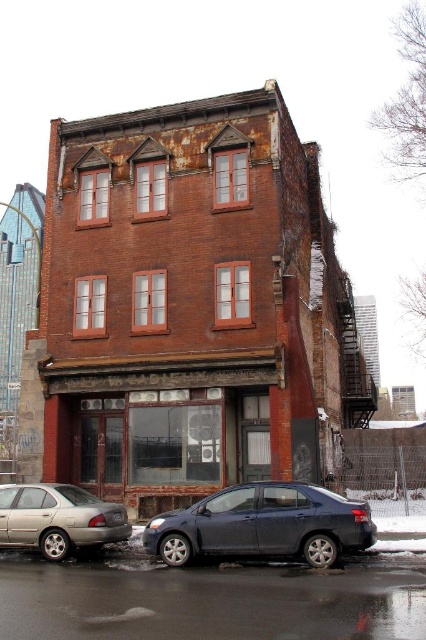
The height and width of the screenshot is (640, 426). What do you see at coordinates (262, 525) in the screenshot?
I see `satin dark blue sedan at lower center` at bounding box center [262, 525].

Is satin dark blue sedan at lower center thinner than silver metallic sedan at lower left?

In fact, satin dark blue sedan at lower center might be wider than silver metallic sedan at lower left.

This screenshot has width=426, height=640. Find the location of `satin dark blue sedan at lower center`. satin dark blue sedan at lower center is located at coordinates (262, 525).